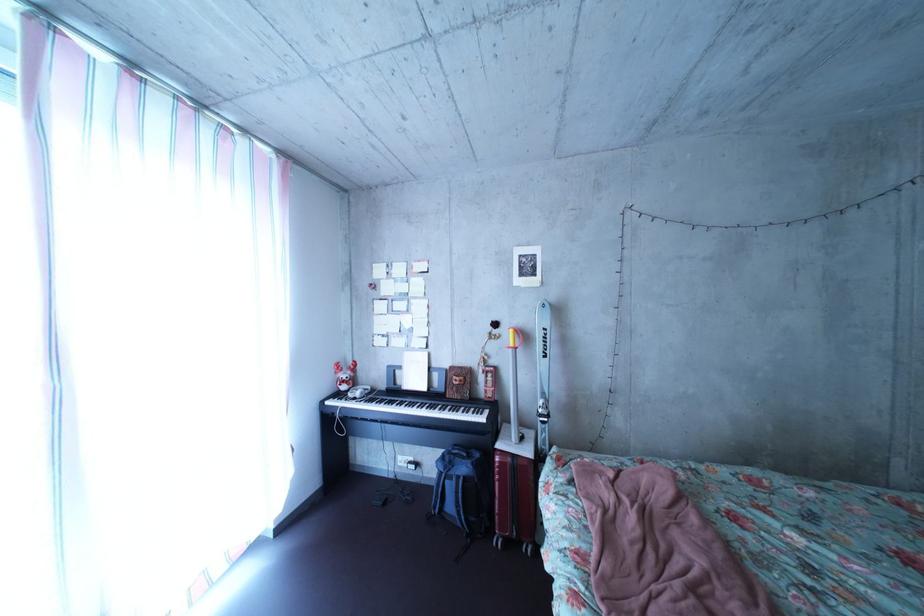
Where is `toy sword handle`? toy sword handle is located at coordinates (511, 339).